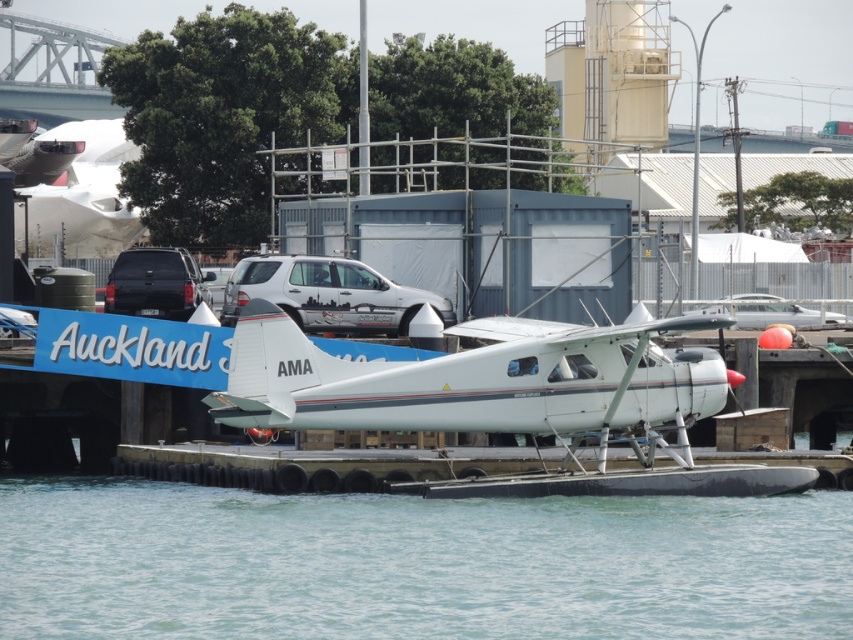
You are standing at the point marked by the coordinates point (328, 294) in the image. What object are you currently standing on?

The point (328, 294) is on the white glossy car at center.

You are a pilot planning to taxi the white matte seaplane at center from its current position to a nearby dock. The dock is located at point 0.6, 0.6. Based on the coordinates provided, will the seaplane need to move north or south to reach the dock?

The white matte seaplane at center is at point (x=473, y=381). The dock is at (x=511, y=384). Since the seaplane is slightly south of the dock, it needs to move north to reach the dock.